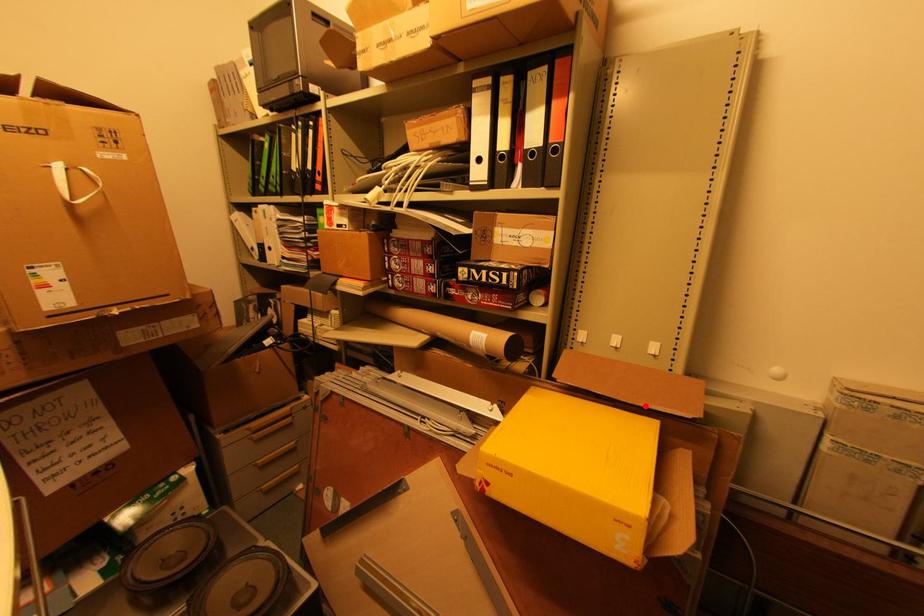
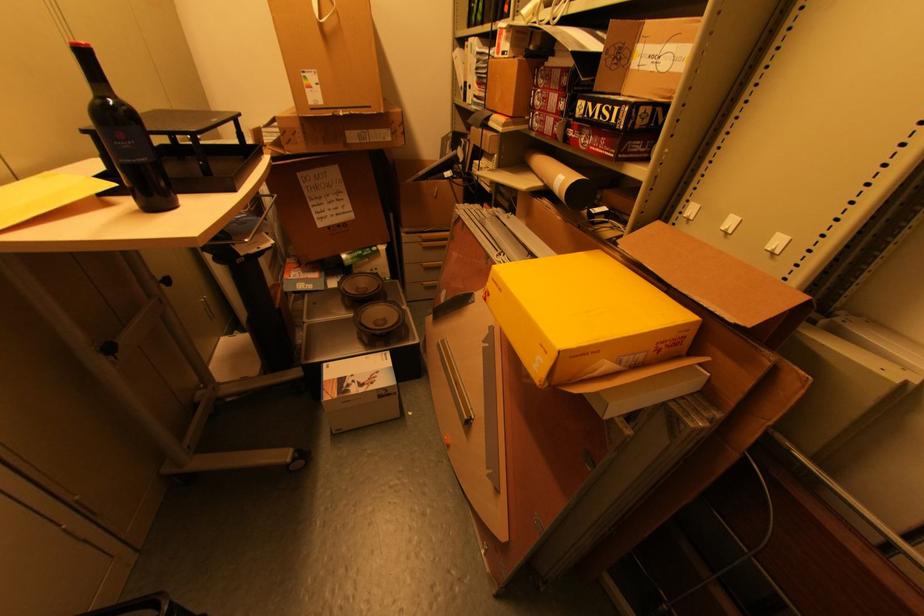
Find the pixel in the second image that matches the highlighted location in the first image.

(688, 294)